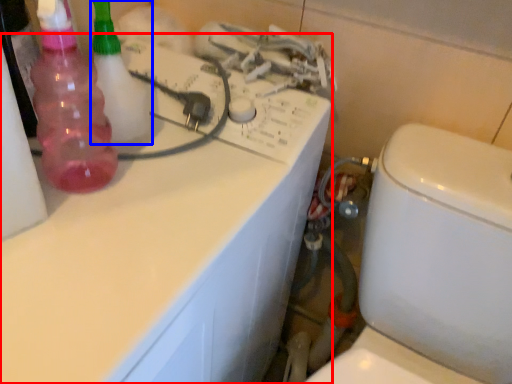
Question: Which point is closer to the camera, counter top (highlighted by a red box) or cleaning product (highlighted by a blue box)?

Choices:
 (A) counter top
 (B) cleaning product

Answer: (A)